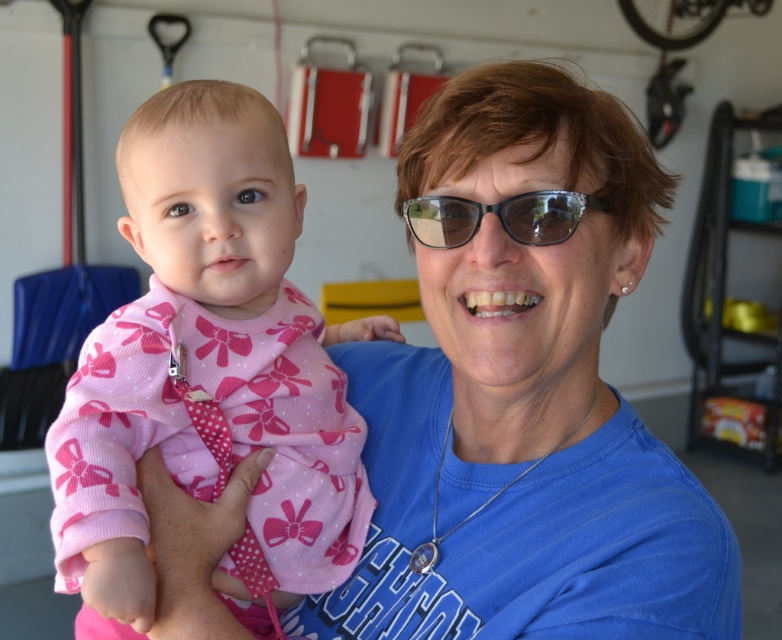
You are organizing a space for a baby in the garage. You have the pink fabric baby at center and the transparent plastic glasses at center. Which object should you prioritize placing in a safe location away from the baby?

The transparent plastic glasses at center should be prioritized for placement in a safe location away from the baby because they are smaller in size and could pose a choking hazard if left accessible.

You are a photographer setting up a shot in a garage. You need to position a pink fabric baby at center so it aligns with the point marked at coordinates (210,368). Is the current position of the pink fabric baby at center already aligned with that point?

The point at coordinates (210,368) marks the pink fabric baby at center, so yes, the baby is already positioned at that point.

You are a photographer setting up a shot in this garage scene. You need to ensure the pink fabric baby at center and the transparent plastic glasses at center are both in focus. Given that the depth of field can only accommodate objects within a 10 cm height difference, will both objects be in focus?

The pink fabric baby at center is taller than transparent plastic glasses at center. Since the height difference is within the 10 cm depth of field, both objects will be in focus.